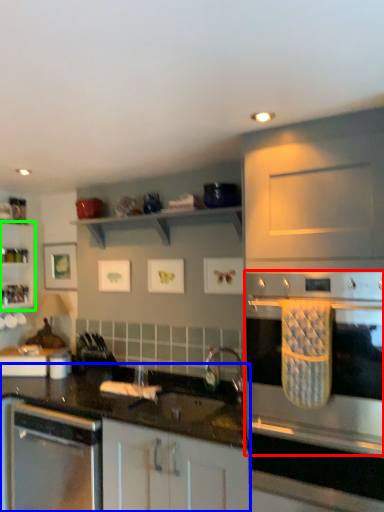
Question: Which object is positioned closest to home appliance (highlighted by a red box)? Select from countertop (highlighted by a blue box) and shelf (highlighted by a green box).

Choices:
 (A) countertop
 (B) shelf

Answer: (A)